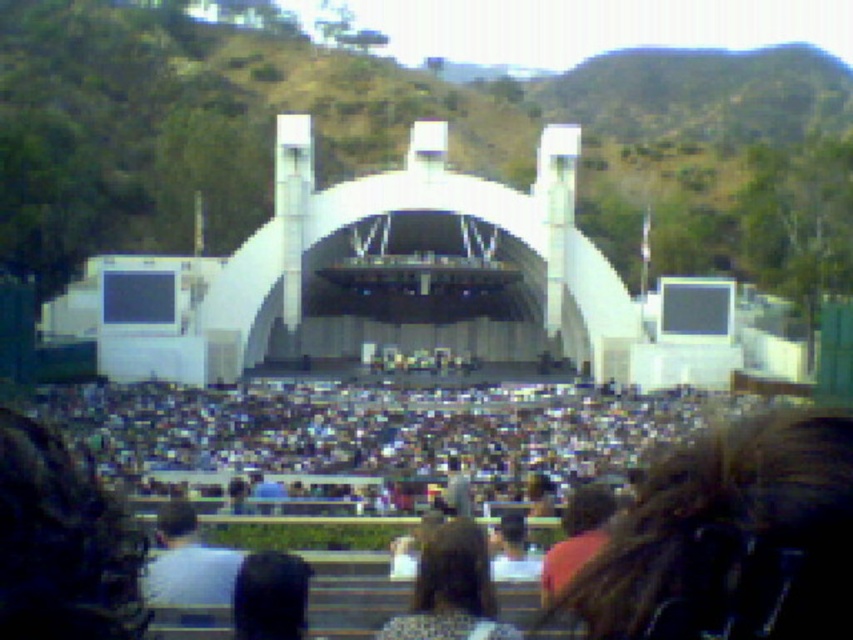
Question: Estimate the real-world distances between objects in this image. Which object is farther from the black fabric at center?

Choices:
 (A) dark brown hair at center
 (B) dark gray crowd at center

Answer: (B)

Question: Among these objects, which one is farthest from the camera?

Choices:
 (A) dark gray crowd at center
 (B) dark brown hair at center
 (C) black fabric at center

Answer: (A)

Question: Which object is closer to the camera taking this photo?

Choices:
 (A) black fabric at center
 (B) dark brown hair at center

Answer: (B)

Question: Where is dark gray crowd at center located in relation to black fabric at center in the image?

Choices:
 (A) above
 (B) below

Answer: (A)

Question: Is dark gray crowd at center above black fabric at center?

Choices:
 (A) no
 (B) yes

Answer: (B)

Question: Is dark gray crowd at center smaller than black fabric at center?

Choices:
 (A) yes
 (B) no

Answer: (B)